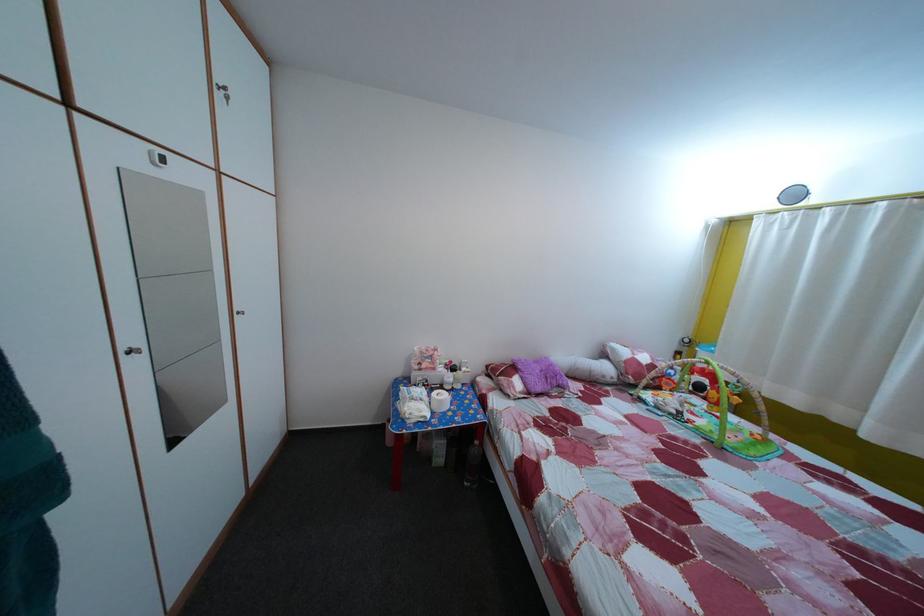
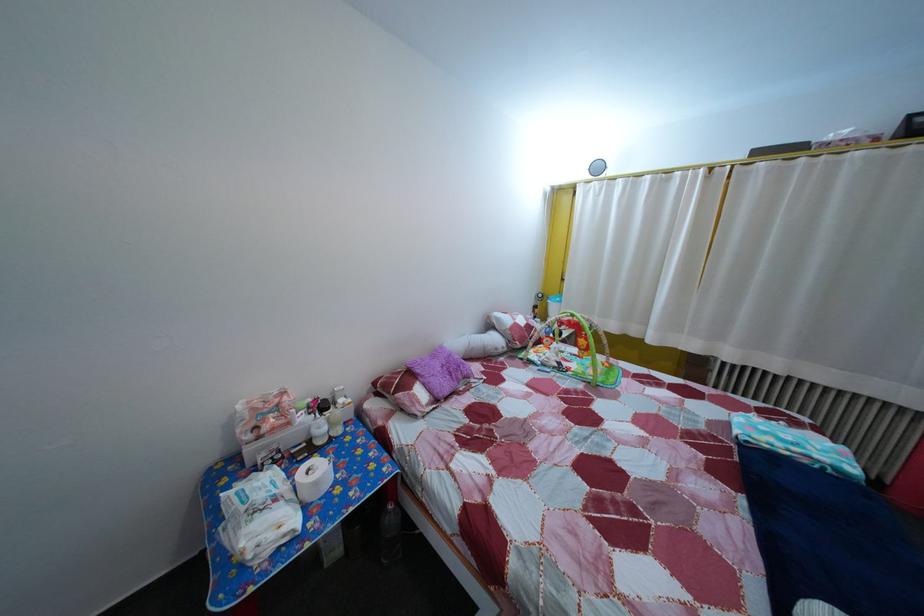
In the second image, find the point that corresponds to (x=444, y=377) in the first image.

(298, 432)